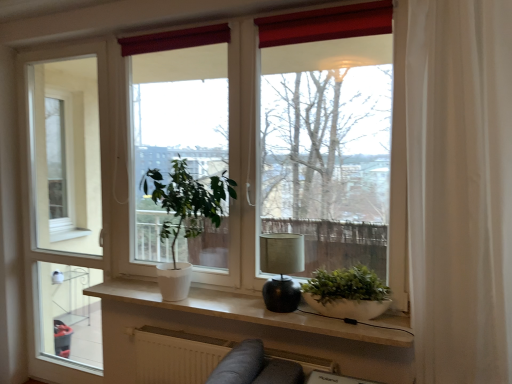
Question: From a real-world perspective, is white matte window at center beneath white matte radiator at lower center?

Choices:
 (A) no
 (B) yes

Answer: (A)

Question: From the image's perspective, is white matte window at center located beneath white matte radiator at lower center?

Choices:
 (A) no
 (B) yes

Answer: (A)

Question: Is white matte radiator at lower center at the back of white matte window at center?

Choices:
 (A) no
 (B) yes

Answer: (A)

Question: Can you confirm if white matte window at center is taller than white matte radiator at lower center?

Choices:
 (A) no
 (B) yes

Answer: (B)

Question: Is white matte window at center to the left of white matte radiator at lower center from the viewer's perspective?

Choices:
 (A) yes
 (B) no

Answer: (B)

Question: Is white matte window at center wider than white matte radiator at lower center?

Choices:
 (A) yes
 (B) no

Answer: (B)

Question: Is the surface of white matte window sill at center in direct contact with white sheer curtain at right?

Choices:
 (A) yes
 (B) no

Answer: (B)

Question: Does white matte window sill at center have a lesser height compared to white sheer curtain at right?

Choices:
 (A) yes
 (B) no

Answer: (A)

Question: Does white matte window sill at center come behind white sheer curtain at right?

Choices:
 (A) no
 (B) yes

Answer: (B)

Question: From the image's perspective, is white matte window sill at center beneath white sheer curtain at right?

Choices:
 (A) no
 (B) yes

Answer: (B)

Question: From a real-world perspective, is white matte window sill at center over white sheer curtain at right?

Choices:
 (A) no
 (B) yes

Answer: (A)

Question: Is white matte window sill at center facing towards white sheer curtain at right?

Choices:
 (A) yes
 (B) no

Answer: (B)

Question: From a real-world perspective, is white matte window at center located higher than matte black lamp at center?

Choices:
 (A) no
 (B) yes

Answer: (B)